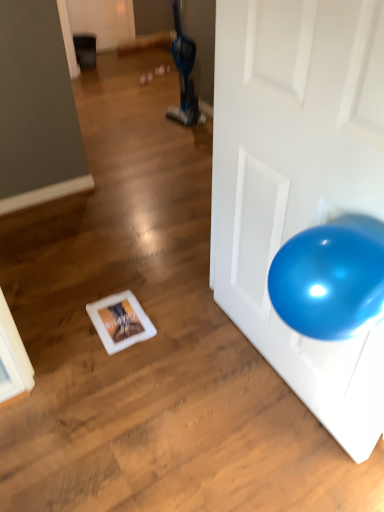
Question: Does blue fabric bean bag chair at upper center have a lesser height compared to glossy white door at right?

Choices:
 (A) yes
 (B) no

Answer: (A)

Question: Is blue fabric bean bag chair at upper center at the right side of glossy white door at right?

Choices:
 (A) no
 (B) yes

Answer: (A)

Question: Is blue fabric bean bag chair at upper center oriented away from glossy white door at right?

Choices:
 (A) no
 (B) yes

Answer: (A)

Question: Is blue fabric bean bag chair at upper center closer to camera compared to glossy white door at right?

Choices:
 (A) no
 (B) yes

Answer: (A)

Question: Is blue fabric bean bag chair at upper center with glossy white door at right?

Choices:
 (A) no
 (B) yes

Answer: (A)

Question: From the image's perspective, is blue fabric bean bag chair at upper center located beneath glossy white door at right?

Choices:
 (A) yes
 (B) no

Answer: (B)

Question: Is the surface of glossy white door at right in direct contact with blue fabric bean bag chair at upper center?

Choices:
 (A) no
 (B) yes

Answer: (A)

Question: Can you confirm if glossy white door at right is thinner than blue fabric bean bag chair at upper center?

Choices:
 (A) no
 (B) yes

Answer: (B)

Question: Is the position of glossy white door at right less distant than that of blue fabric bean bag chair at upper center?

Choices:
 (A) yes
 (B) no

Answer: (A)

Question: Is glossy white door at right facing away from blue fabric bean bag chair at upper center?

Choices:
 (A) yes
 (B) no

Answer: (B)

Question: Is glossy white door at right further to the viewer compared to blue fabric bean bag chair at upper center?

Choices:
 (A) yes
 (B) no

Answer: (B)

Question: Is glossy white door at right not close to blue fabric bean bag chair at upper center?

Choices:
 (A) yes
 (B) no

Answer: (A)

Question: Would you say blue fabric bean bag chair at upper center is to the left or to the right of glossy white door at right in the picture?

Choices:
 (A) left
 (B) right

Answer: (A)